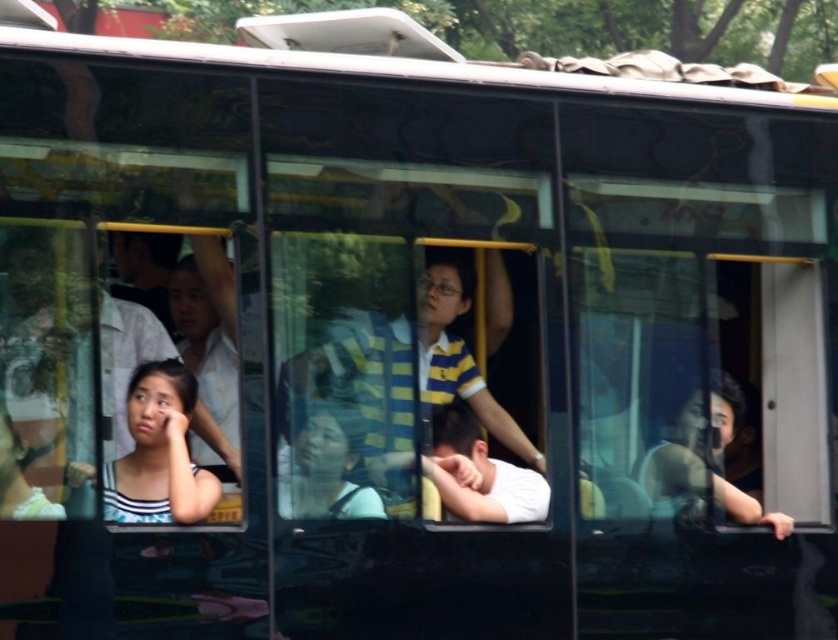
Question: Does yellow striped shirt at center have a smaller size compared to striped fabric face at lower left?

Choices:
 (A) yes
 (B) no

Answer: (B)

Question: Is yellow striped shirt at center further to camera compared to striped fabric face at lower left?

Choices:
 (A) no
 (B) yes

Answer: (B)

Question: Which object appears closest to the camera in this image?

Choices:
 (A) yellow striped shirt at center
 (B) striped fabric face at lower left

Answer: (B)

Question: Which of the following is the closest to the observer?

Choices:
 (A) click(194, 490)
 (B) click(448, 316)

Answer: (A)

Question: Is yellow striped shirt at center thinner than striped fabric face at lower left?

Choices:
 (A) no
 (B) yes

Answer: (A)